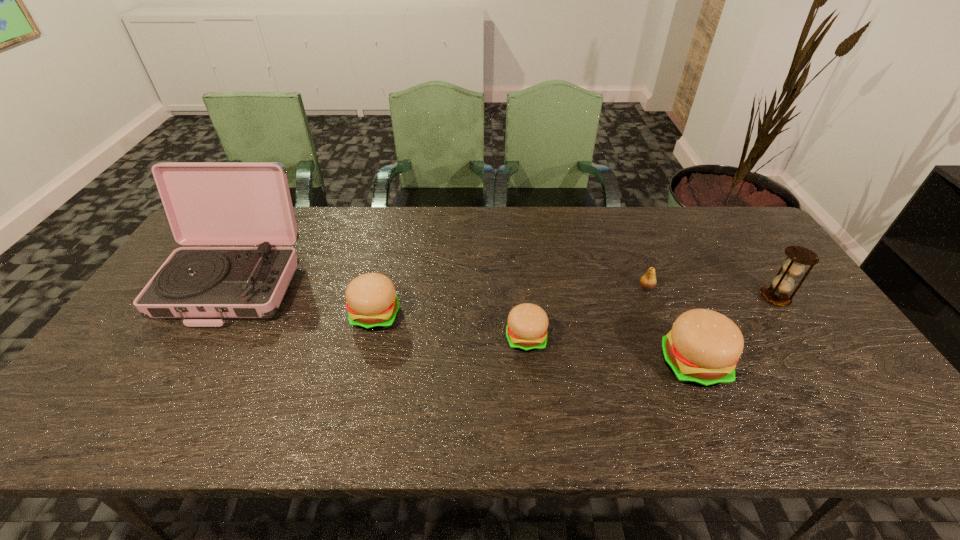
Locate an element on the screen. free point that keeps the hamburgers evenly spaced on the right is located at coordinates (878, 392).